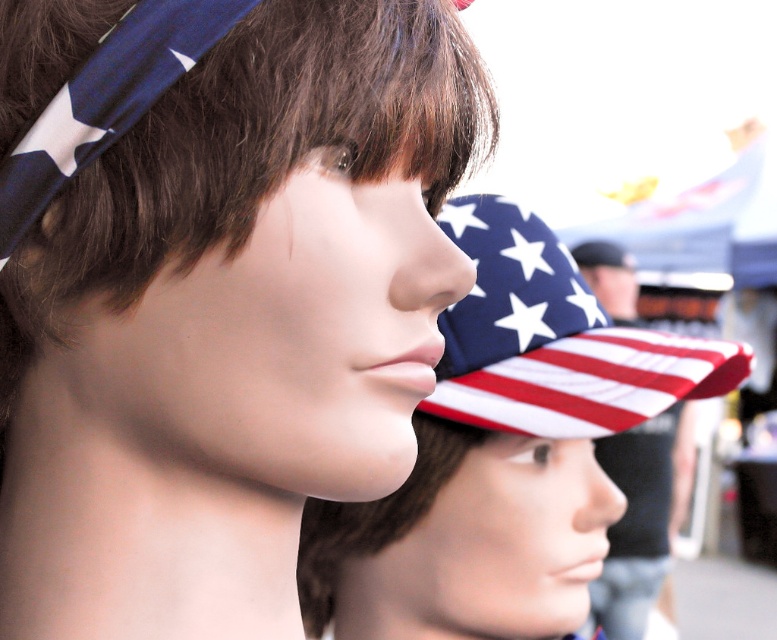
Between american flag fabric baseball cap at center and american flag hat at center, which one appears on the right side from the viewer's perspective?

From the viewer's perspective, american flag hat at center appears more on the right side.

Between american flag fabric baseball cap at center and american flag hat at center, which one is positioned lower?

american flag hat at center is below.

The image size is (777, 640). I want to click on american flag fabric baseball cap at center, so tap(553, 339).

You are a GUI agent. You are given a task and a screenshot of the screen. Output one action in this format:
    pyautogui.click(x=<x>, y=<y>)
    Task: Click on the american flag fabric baseball cap at center
    The width and height of the screenshot is (777, 640).
    Given the screenshot: What is the action you would take?
    pyautogui.click(x=553, y=339)

Describe the element at coordinates (232, 321) in the screenshot. I see `matte plastic mannequin head at center` at that location.

Consider the image. Between matte plastic mannequin head at center and american flag hat at center, which one is positioned lower?

american flag hat at center

What do you see at coordinates (232, 321) in the screenshot? I see `matte plastic mannequin head at center` at bounding box center [232, 321].

The image size is (777, 640). What are the coordinates of `matte plastic mannequin head at center` in the screenshot? It's located at (232, 321).

Is matte plastic mannequin head at center taller than american flag fabric baseball cap at center?

Correct, matte plastic mannequin head at center is much taller as american flag fabric baseball cap at center.

Between matte plastic mannequin head at center and american flag fabric baseball cap at center, which one appears on the right side from the viewer's perspective?

american flag fabric baseball cap at center

Is point (214, 438) positioned before point (530, 420)?

Yes, point (214, 438) is in front of point (530, 420).

Where is `matte plastic mannequin head at center`? This screenshot has height=640, width=777. matte plastic mannequin head at center is located at coordinates (232, 321).